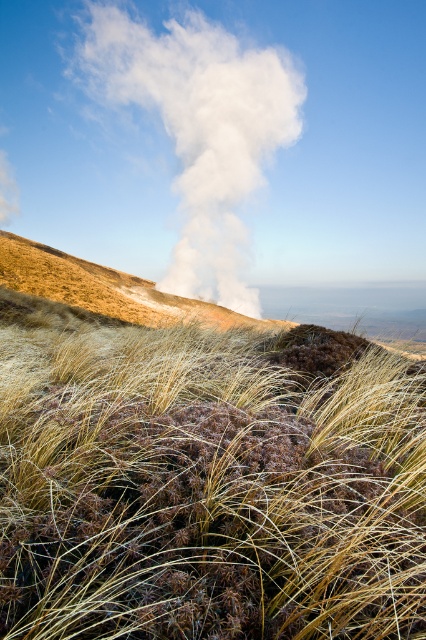
Question: Where is dry grass at center located in relation to brown grassy hillside at center in the image?

Choices:
 (A) left
 (B) right

Answer: (B)

Question: Is dry grass at center above white smoke at upper center?

Choices:
 (A) no
 (B) yes

Answer: (A)

Question: Which object is positioned closest to the white smoke at upper center?

Choices:
 (A) dry grass at center
 (B) brown grassy hillside at center

Answer: (B)

Question: Which point is closer to the camera?

Choices:
 (A) (221, 480)
 (B) (282, 321)

Answer: (A)

Question: Which of the following is the closest to the observer?

Choices:
 (A) brown grassy hillside at center
 (B) white smoke at upper center
 (C) dry grass at center

Answer: (C)

Question: Is white smoke at upper center above brown grassy hillside at center?

Choices:
 (A) no
 (B) yes

Answer: (B)